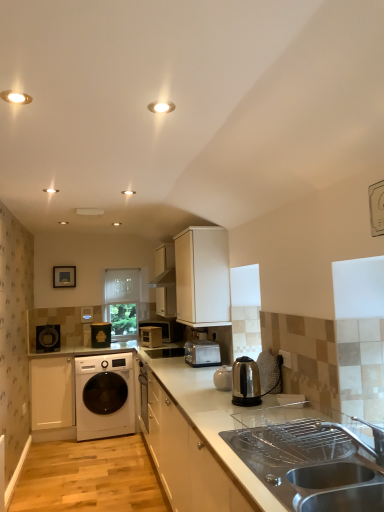
Locate an element on the screen. The width and height of the screenshot is (384, 512). vacant region to the right of stainless steel kettle at center, marked as the first home appliance in a right-to-left arrangement is located at coordinates (273, 406).